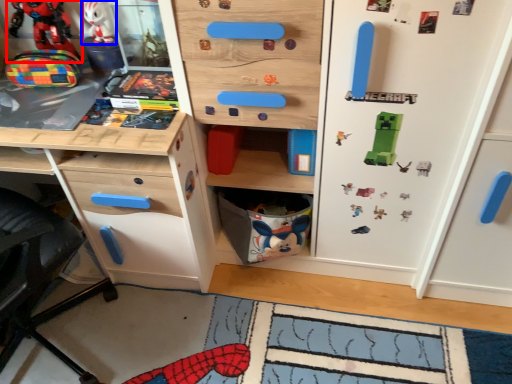
Question: Which of the following is the farthest to the observer, toy (highlighted by a red box) or toy (highlighted by a blue box)?

Choices:
 (A) toy
 (B) toy

Answer: (B)